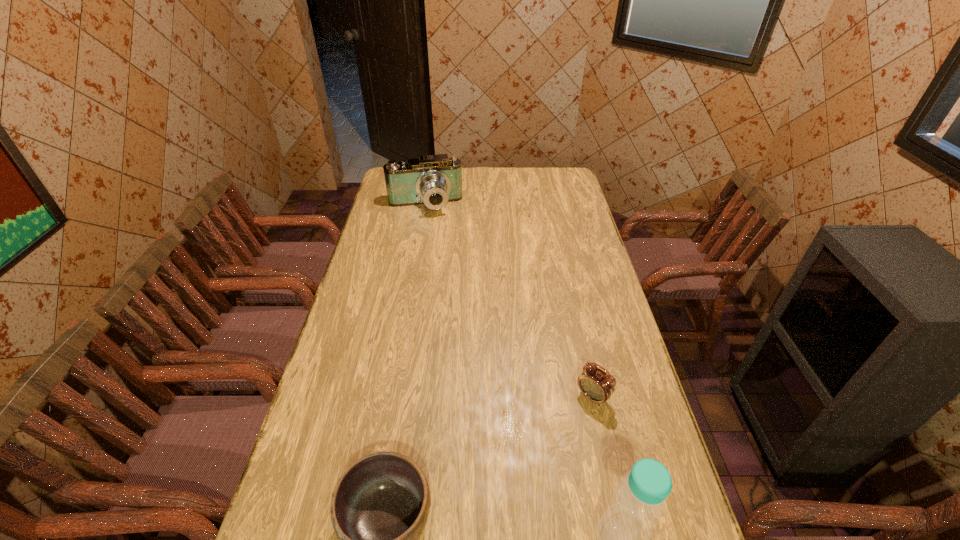
Locate an element on the screen. This screenshot has height=540, width=960. object that is at the right edge is located at coordinates (598, 386).

The image size is (960, 540). In order to click on free region at the far edge in this screenshot , I will do `click(506, 185)`.

This screenshot has height=540, width=960. What are the coordinates of `vacant space at the left edge of the desktop` in the screenshot? It's located at (372, 322).

Identify the location of free space at the right edge. (643, 390).

Identify the location of free space between the farthest object and the alarm clock. click(x=509, y=301).

Identify the location of free point between the third nearest object and the camcorder. (509, 301).

Find the location of a particular element. the closest object to the farthest object is located at coordinates (598, 386).

Point out which object is positioned as the nearest to the bowl. Please provide its 2D coordinates. Your answer should be formatted as a tuple, i.e. [(x, y)], where the tuple contains the x and y coordinates of a point satisfying the conditions above.

[(640, 499)]

Locate an element on the screen. Image resolution: width=960 pixels, height=540 pixels. vacant space that satisfies the following two spatial constraints: 1. on the front side of the second tallest object; 2. on the right side of the alarm clock is located at coordinates (391, 397).